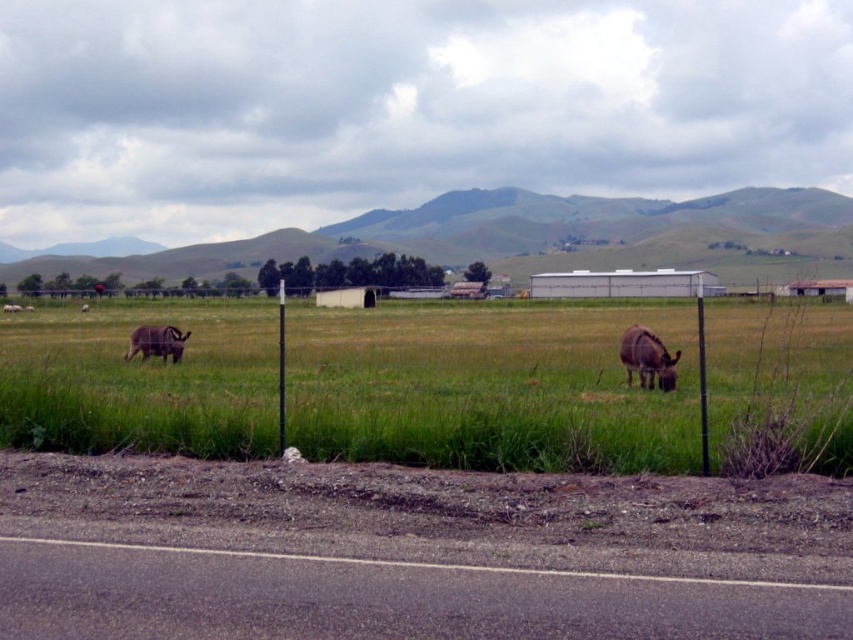
Question: Can you confirm if green grassy field at center is wider than brown furry goat at left?

Choices:
 (A) yes
 (B) no

Answer: (A)

Question: Can you confirm if green grassy field at center is positioned to the right of brown fuzzy goat at left?

Choices:
 (A) yes
 (B) no

Answer: (A)

Question: Which point is closer to the camera?

Choices:
 (A) (282, 387)
 (B) (9, 308)
 (C) (166, 353)

Answer: (A)

Question: Which is farther from the black metal pole at center?

Choices:
 (A) brown furry goat at left
 (B) brown fuzzy donkey at center
 (C) brown fuzzy goat at left

Answer: (A)

Question: From the image, what is the correct spatial relationship of green grassy field at center in relation to black metal pole at center?

Choices:
 (A) right
 (B) left

Answer: (A)

Question: Which object appears closest to the camera in this image?

Choices:
 (A) brown fuzzy goat at left
 (B) green grassy field at center
 (C) black metal pole at center
 (D) brown furry goat at left

Answer: (B)